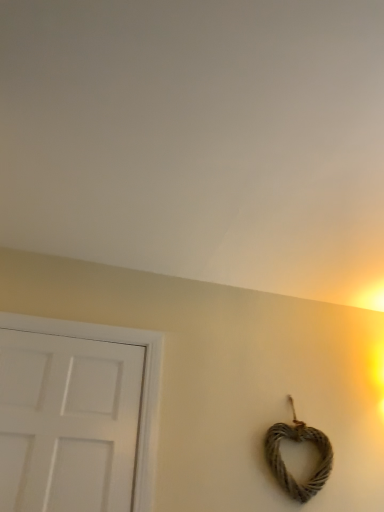
What is the approximate height of white matte door at left?

white matte door at left is 29.00 inches tall.

Image resolution: width=384 pixels, height=512 pixels. Describe the element at coordinates (67, 422) in the screenshot. I see `white matte door at left` at that location.

What is the approximate width of white matte door at left?

4.11 inches.

This screenshot has width=384, height=512. Find the location of `white matte door at left`. white matte door at left is located at coordinates (67, 422).

Describe the element at coordinates (284, 463) in the screenshot. I see `rustic brown rope heart at lower right` at that location.

Find the location of a particular element. rustic brown rope heart at lower right is located at coordinates (284, 463).

Identify the location of white matte door at left. The image size is (384, 512). (67, 422).

Visually, is rustic brown rope heart at lower right positioned to the left or to the right of white matte door at left?

From the image, it's evident that rustic brown rope heart at lower right is to the right of white matte door at left.

Is rustic brown rope heart at lower right further to the viewer compared to white matte door at left?

Yes, the depth of rustic brown rope heart at lower right is greater than that of white matte door at left.

Between point (310, 484) and point (136, 403), which one is positioned behind?

The point (310, 484) is more distant.

Consider the image. From the image's perspective, is rustic brown rope heart at lower right located above white matte door at left?

No, from the image's perspective, rustic brown rope heart at lower right is not over white matte door at left.

From a real-world perspective, is rustic brown rope heart at lower right physically below white matte door at left?

Yes, from a real-world perspective, rustic brown rope heart at lower right is under white matte door at left.

Considering the relative sizes of rustic brown rope heart at lower right and white matte door at left in the image provided, is rustic brown rope heart at lower right thinner than white matte door at left?

Yes, rustic brown rope heart at lower right is thinner than white matte door at left.

Considering the sizes of rustic brown rope heart at lower right and white matte door at left in the image, is rustic brown rope heart at lower right taller or shorter than white matte door at left?

Clearly, rustic brown rope heart at lower right is shorter compared to white matte door at left.

Considering the sizes of objects rustic brown rope heart at lower right and white matte door at left in the image provided, who is bigger, rustic brown rope heart at lower right or white matte door at left?

With larger size is white matte door at left.

Is rustic brown rope heart at lower right located outside white matte door at left?

Yes, rustic brown rope heart at lower right is located beyond the bounds of white matte door at left.

Is rustic brown rope heart at lower right placed right next to white matte door at left?

No, rustic brown rope heart at lower right is not making contact with white matte door at left.

Could you tell me if rustic brown rope heart at lower right is facing white matte door at left?

No, rustic brown rope heart at lower right is not turned towards white matte door at left.

At what (x,y) coordinates should I click in order to perform the action: click on door on the left of rustic brown rope heart at lower right. Please return your answer as a coordinate pair (x, y). Looking at the image, I should click on (67, 422).

Would you say white matte door at left is to the left or to the right of rustic brown rope heart at lower right in the picture?

Clearly, white matte door at left is on the left of rustic brown rope heart at lower right in the image.

Does white matte door at left come in front of rustic brown rope heart at lower right?

Yes.

Considering the points (142, 367) and (285, 479), which point is behind, point (142, 367) or point (285, 479)?

The point (142, 367) is more distant.

From the image's perspective, relative to rustic brown rope heart at lower right, is white matte door at left above or below?

Based on their image positions, white matte door at left is located above rustic brown rope heart at lower right.

From a real-world perspective, between white matte door at left and rustic brown rope heart at lower right, who is vertically higher?

From a 3D spatial view, white matte door at left is above.

Looking at their sizes, would you say white matte door at left is wider or thinner than rustic brown rope heart at lower right?

white matte door at left is wider than rustic brown rope heart at lower right.

Between white matte door at left and rustic brown rope heart at lower right, which one has less height?

Standing shorter between the two is rustic brown rope heart at lower right.

In terms of size, does white matte door at left appear bigger or smaller than rustic brown rope heart at lower right?

Considering their sizes, white matte door at left takes up more space than rustic brown rope heart at lower right.

Is rustic brown rope heart at lower right surrounded by white matte door at left?

No, rustic brown rope heart at lower right is located outside of white matte door at left.

In the scene shown: Is there a large distance between white matte door at left and rustic brown rope heart at lower right?

No, white matte door at left is not far away from rustic brown rope heart at lower right.

Could you tell me if white matte door at left is turned towards rustic brown rope heart at lower right?

No.

I want to click on door that is above the rustic brown rope heart at lower right (from a real-world perspective), so click(x=67, y=422).

At what (x,y) coordinates should I click in order to perform the action: click on door above the rustic brown rope heart at lower right (from the image's perspective). Please return your answer as a coordinate pair (x, y). Image resolution: width=384 pixels, height=512 pixels. Looking at the image, I should click on (67, 422).

Locate an element on the screen. door in front of the rustic brown rope heart at lower right is located at coordinates (67, 422).